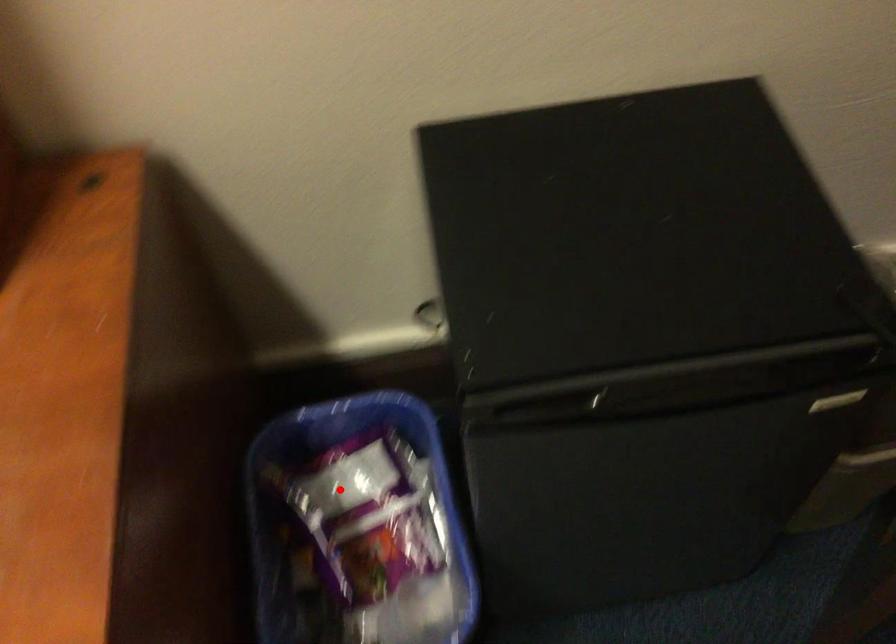
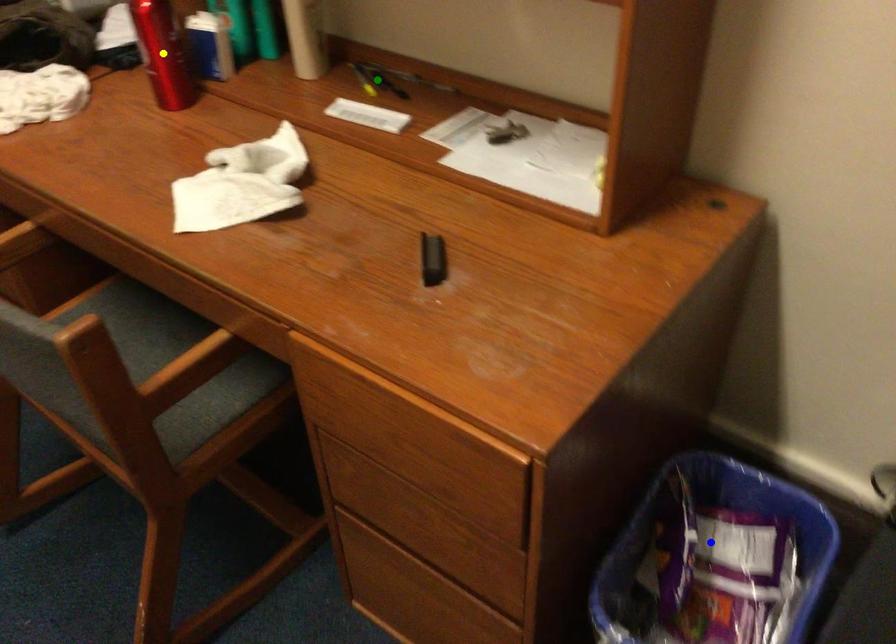
Question: I am providing you with two images of the same scene from different viewpoints. A red point is marked on the first image. You are given multiple points on the second image. Which mark in image 2 goes with the point in image 1?

Choices:
 (A) yellow point
 (B) green point
 (C) blue point

Answer: (C)